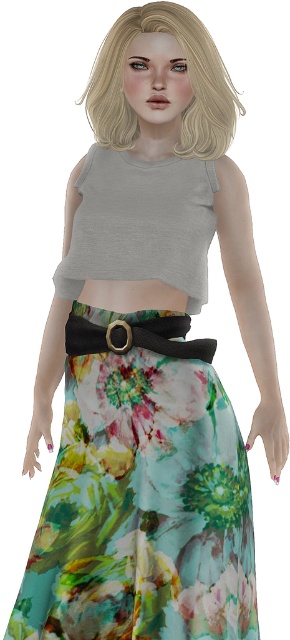
Question: Can you confirm if matte gray tank top at center is positioned below matte black belt at center?

Choices:
 (A) yes
 (B) no

Answer: (B)

Question: Which object is farther from the camera taking this photo?

Choices:
 (A) blondehair at upper center
 (B) matte black belt at center

Answer: (A)

Question: Which of the following is the farthest from the observer?

Choices:
 (A) (122, 342)
 (B) (220, 108)
 (C) (174, 602)
 (D) (80, 228)

Answer: (B)

Question: Is matte gray tank top at center wider than matte black belt at center?

Choices:
 (A) yes
 (B) no

Answer: (A)

Question: Where is matte gray tank top at center located in relation to blondehair at upper center in the image?

Choices:
 (A) left
 (B) right

Answer: (A)

Question: Which of the following is the closest to the observer?

Choices:
 (A) matte gray tank top at center
 (B) floral chiffon skirt at lower center

Answer: (B)